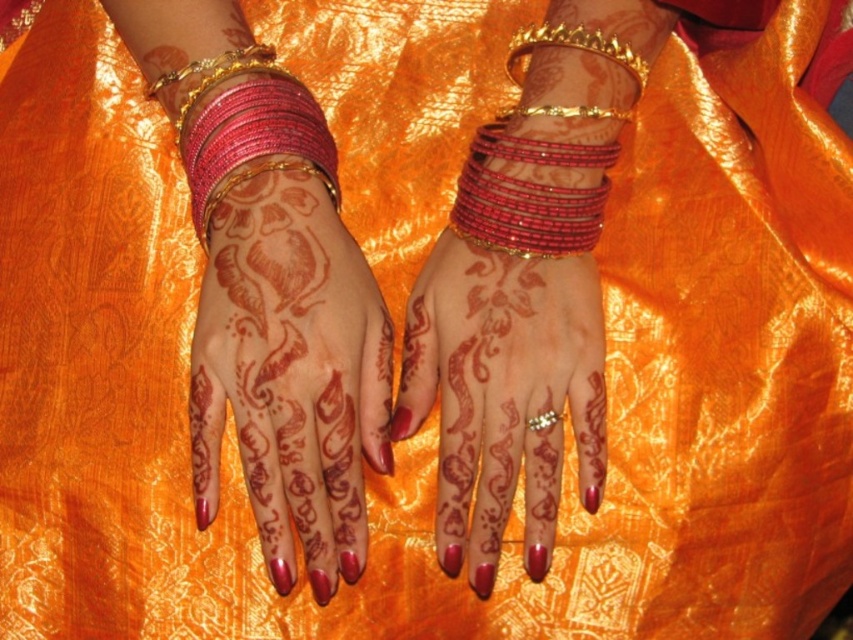
You are a jeweler examining the hands in the image. You need to determine which of the two items, the shiny pink beaded bangles at left or the gold metallic bracelet at upper left, is taller. Based on the scene, which one is taller?

The shiny pink beaded bangles at left has a greater height compared to the gold metallic bracelet at upper left, so the shiny pink beaded bangles at left is taller.